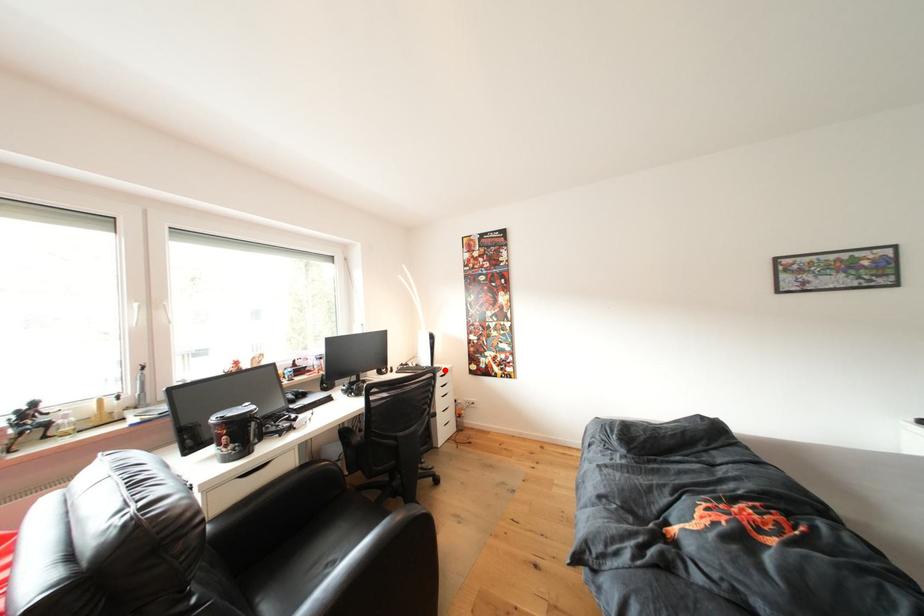
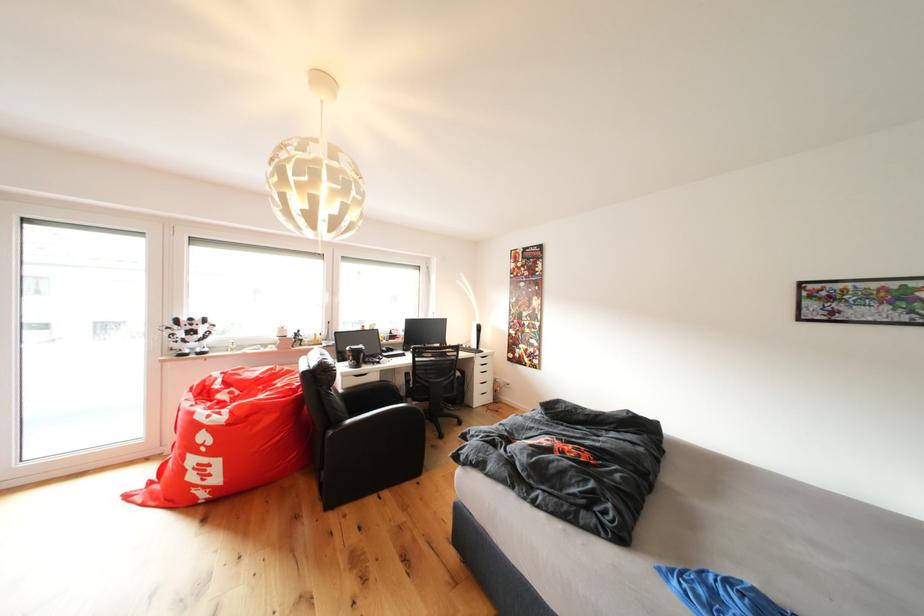
Find the pixel in the second image that matches the highlighted location in the first image.

(490, 354)